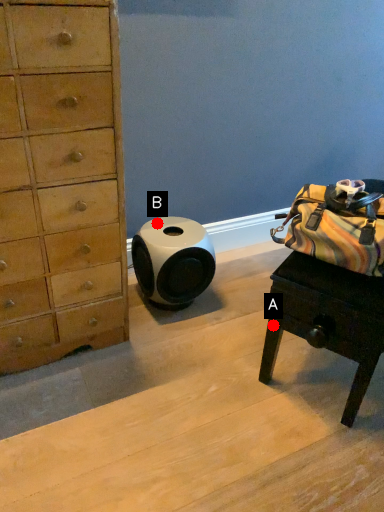
Question: Two points are circled on the image, labeled by A and B beside each circle. Which of the following is the closest to the observer?

Choices:
 (A) A is closer
 (B) B is closer

Answer: (A)